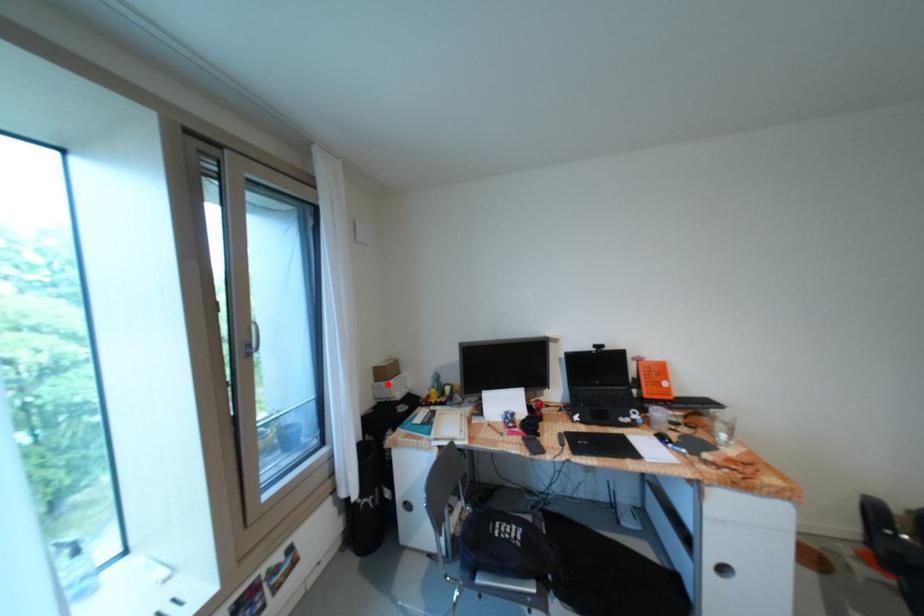
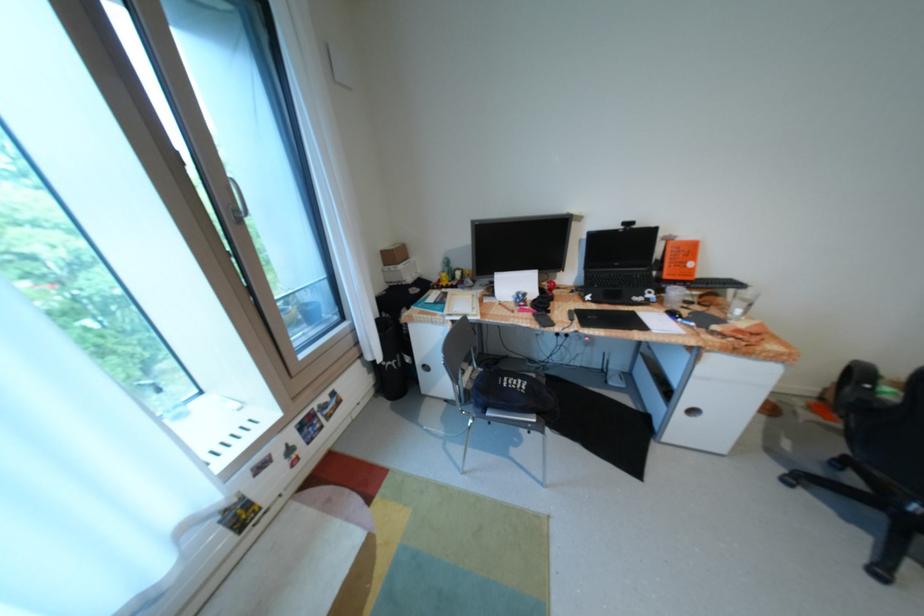
The point at the highlighted location is marked in the first image. Where is the corresponding point in the second image?

(397, 268)